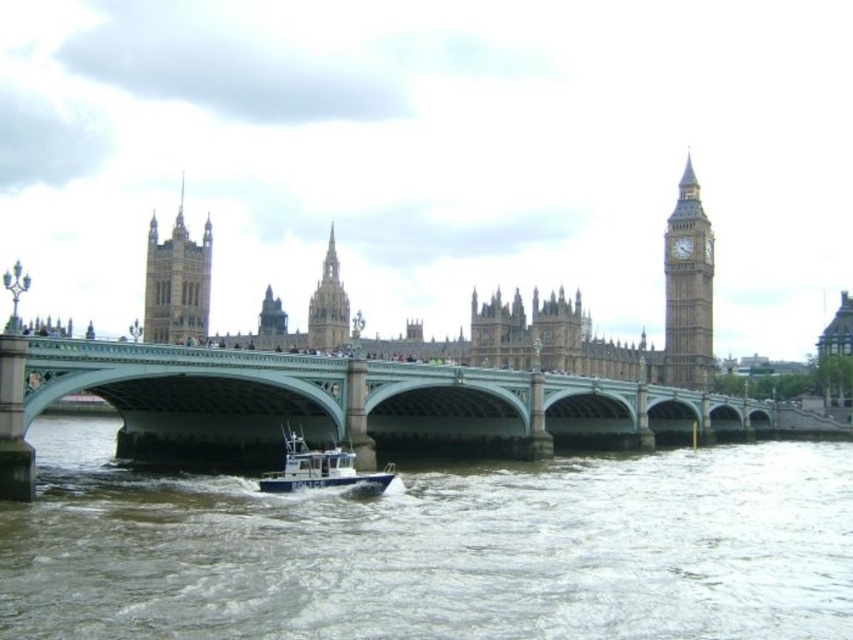
You are a tourist standing on the bank of the river. You see the green stone bridge at center and the golden stone tower at upper left. Which one do you see first as you look towards the river?

The green stone bridge at center is closer to the viewer than the golden stone tower at upper left, so you would see the green stone bridge at center first when looking towards the river.

You are standing at the camera position and want to reach the point marked at coordinates point (582,424). Can you estimate how far you need to walk to get there?

The distance between point (582,424) and the camera is 101.91 meters, so you would need to walk approximately 101.91 meters to reach that point.